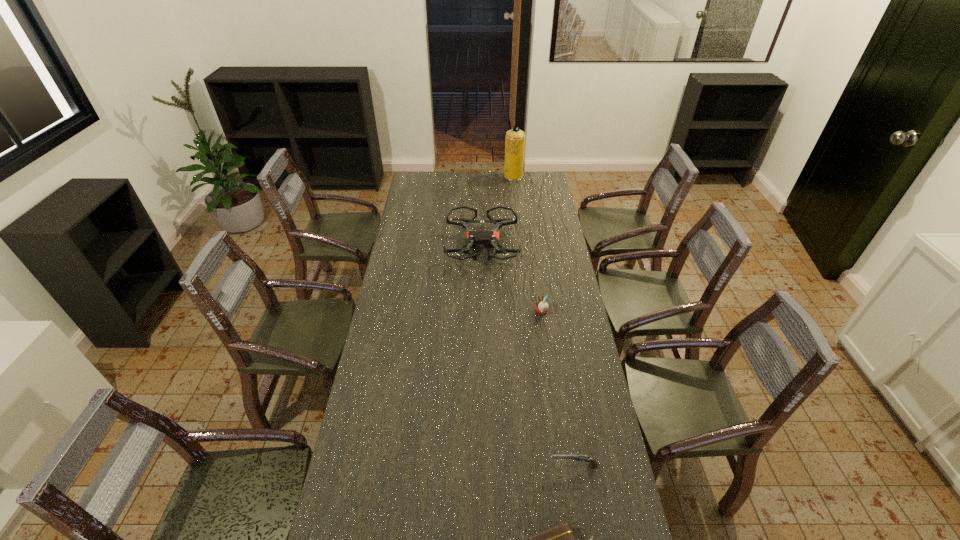
The height and width of the screenshot is (540, 960). What are the coordinates of `vacant area at the right edge of the desktop` in the screenshot? It's located at (552, 293).

Locate an element on the screen. The width and height of the screenshot is (960, 540). vacant area at the far right corner of the desktop is located at coordinates (533, 183).

In order to click on free space between the fourth nearest object and the fourth farthest object in this screenshot , I will do `click(528, 355)`.

Identify the location of vacant space that's between the gun and the muffin. (558, 388).

The width and height of the screenshot is (960, 540). What are the coordinates of `vacant space that is in between the muffin and the farthest object` in the screenshot? It's located at (527, 244).

Identify the location of vacant space in between the farthest object and the fourth nearest object. (497, 211).

I want to click on free space between the third nearest object and the second nearest object, so click(x=558, y=388).

Where is `free area in between the aerosol can and the third nearest object`? This screenshot has height=540, width=960. free area in between the aerosol can and the third nearest object is located at coordinates (527, 244).

Identify which object is the third nearest to the drone. Please provide its 2D coordinates. Your answer should be formatted as a tuple, i.e. [(x, y)], where the tuple contains the x and y coordinates of a point satisfying the conditions above.

[(593, 463)]

You are a GUI agent. You are given a task and a screenshot of the screen. Output one action in this format:
    pyautogui.click(x=<x>, y=<y>)
    Task: Click on the object that is the fourth closest to the muffin
    The image size is (960, 540).
    Given the screenshot: What is the action you would take?
    pyautogui.click(x=515, y=138)